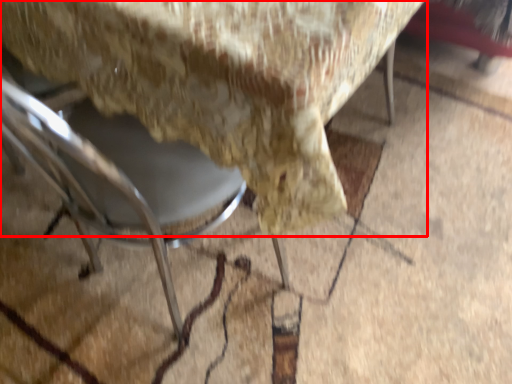
Question: From the image's perspective, what is the correct spatial relationship of chair (annotated by the red box) in relation to chair?

Choices:
 (A) below
 (B) above

Answer: (B)